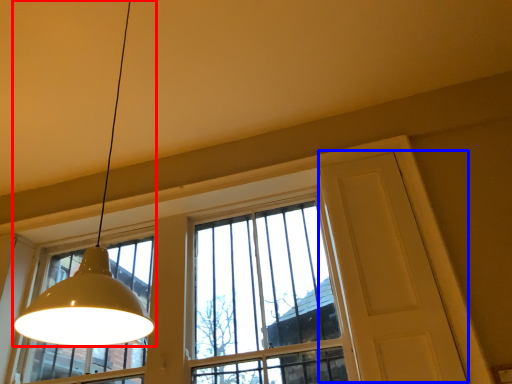
Question: Among these objects, which one is farthest to the camera, lamp (highlighted by a red box) or screen door (highlighted by a blue box)?

Choices:
 (A) lamp
 (B) screen door

Answer: (B)